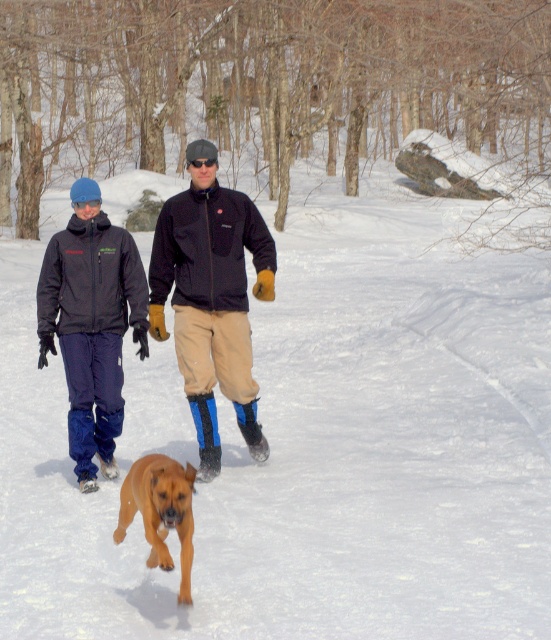
Please describe the location of the khaki pants at center in the winter scene using coordinates. The scene has a coordinate system where the bottom left corner is the origin point. The x and y axes are normalized between 0 and 1. The x axis increases to the right, and the y axis increases upward. The coordinate is given in the format of a tuple with two decimal numbers, like this example format, but you should not use the example numbers. You must use the exact coordinate values provided in the Objects Des.

The khaki pants at center are located at the coordinate point of (212,298).

You are standing in the snowy landscape and see two points marked in the image. Which point is closer to you, point (215, 310) or point (180, 525)?

Point (215, 310) is closer to you because it is further to the viewer than point (180, 525).